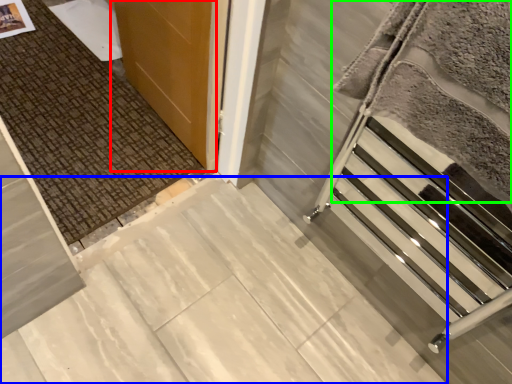
Question: Considering the real-world distances, which object is farthest from door (highlighted by a red box)? concrete (highlighted by a blue box) or blanket (highlighted by a green box)?

Choices:
 (A) concrete
 (B) blanket

Answer: (B)